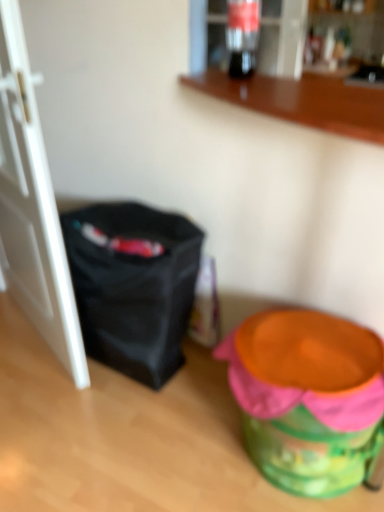
Question: Is translucent glass soda at upper center to the left or to the right of wooden counter at upper center in the image?

Choices:
 (A) left
 (B) right

Answer: (A)

Question: Looking at their shapes, would you say translucent glass soda at upper center is wider or thinner than wooden counter at upper center?

Choices:
 (A) wide
 (B) thin

Answer: (B)

Question: Based on their relative distances, which object is farther from the translucent glass soda at upper center?

Choices:
 (A) white matte door at left
 (B) black fabric bag at left
 (C) orange plastic potty at lower right
 (D) wooden counter at upper center

Answer: (C)

Question: Which object is positioned closest to the orange plastic potty at lower right?

Choices:
 (A) black fabric bag at left
 (B) white matte door at left
 (C) wooden counter at upper center
 (D) translucent glass soda at upper center

Answer: (A)